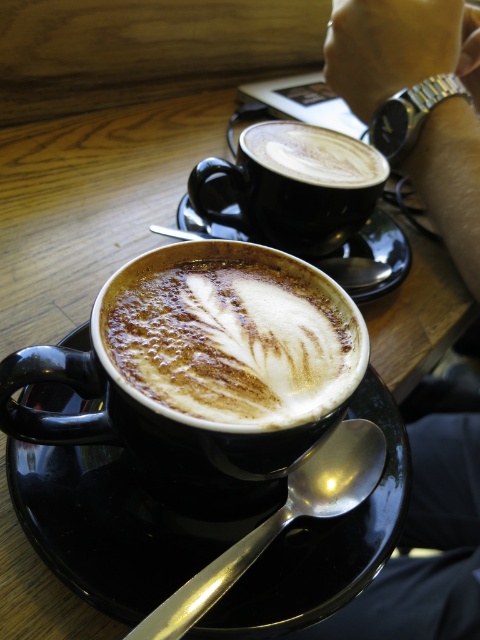
You are a barista who needs to place a 15 inch long cake on the table between the silver metallic spoon at lower center and the matte black cup at upper center. Will the cake fit in the space between them?

The silver metallic spoon at lower center is 17.34 inches away from matte black cup at upper center, so yes, the cake will fit between them since the distance is greater than the cake length.

You are a barista trying to place a matte black cup at upper center onto the black ceramic saucer at center. Will the cup fit entirely on the saucer?

The black ceramic saucer at center is wider than the matte black cup at upper center, so the cup will fit entirely on the saucer.